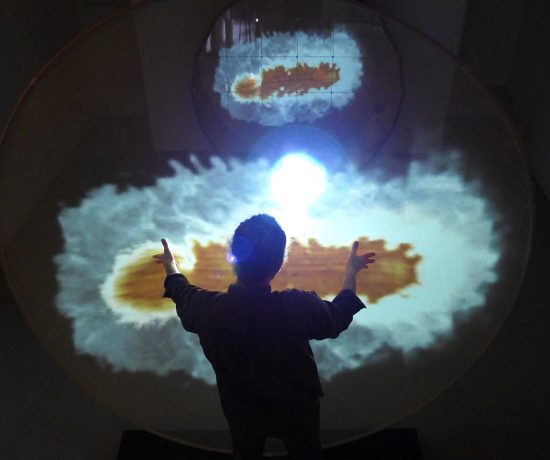
This screenshot has height=460, width=550. I want to click on marble, so click(x=291, y=64).